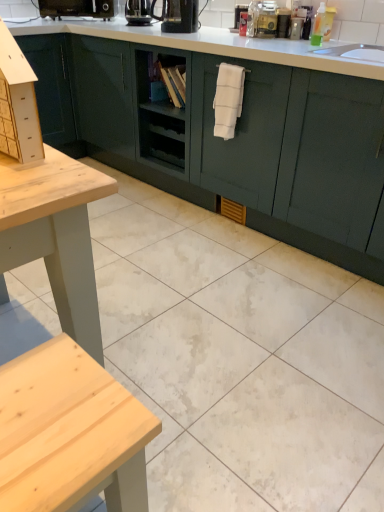
The height and width of the screenshot is (512, 384). In order to click on vacant area that is in front of black plastic coffee machine at upper center, which ranks as the third coffee machine in back-to-front order in this screenshot , I will do `click(190, 34)`.